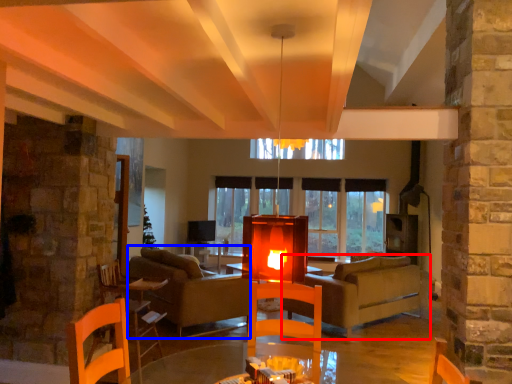
Question: Among these objects, which one is farthest to the camera, studio couch (highlighted by a red box) or couch (highlighted by a blue box)?

Choices:
 (A) studio couch
 (B) couch

Answer: (A)